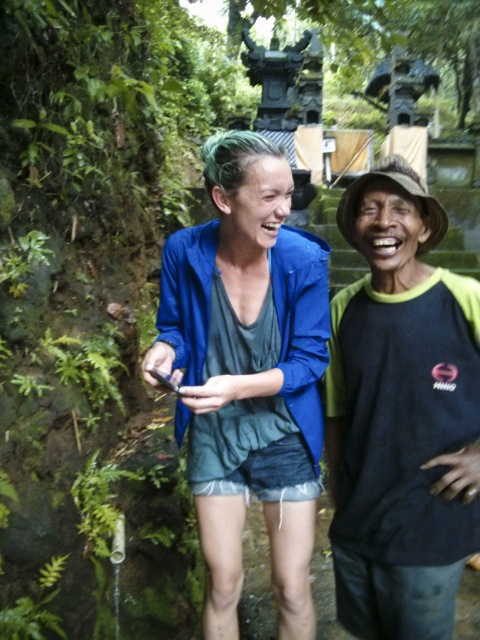
You are a photographer trying to capture the scene. The point at coordinates (248, 372) is crucial for your composition. Which object in the scene is located at this point?

The point at coordinates (248, 372) is located on the blue denim shorts at lower center.

You are a photographer trying to capture a photo of the black matte hat at upper right without including the blue denim shorts at lower center in the frame. Based on their positions, is this possible?

The blue denim shorts at lower center is positioned on the left side of black matte hat at upper right, so the photographer can adjust the camera angle to exclude the blue denim shorts at lower center by focusing on the right side of the black matte hat at upper right.

You are a fashion designer observing the two items in the image. Which item has a bigger size between the blue denim shorts at lower center and the black matte hat at upper right?

The blue denim shorts at lower center has a larger size compared to the black matte hat at upper right.